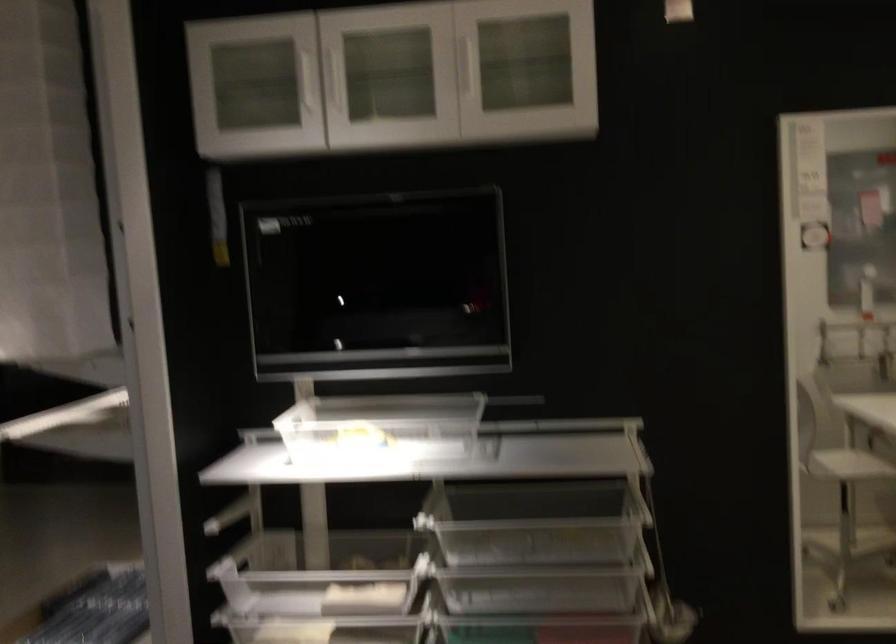
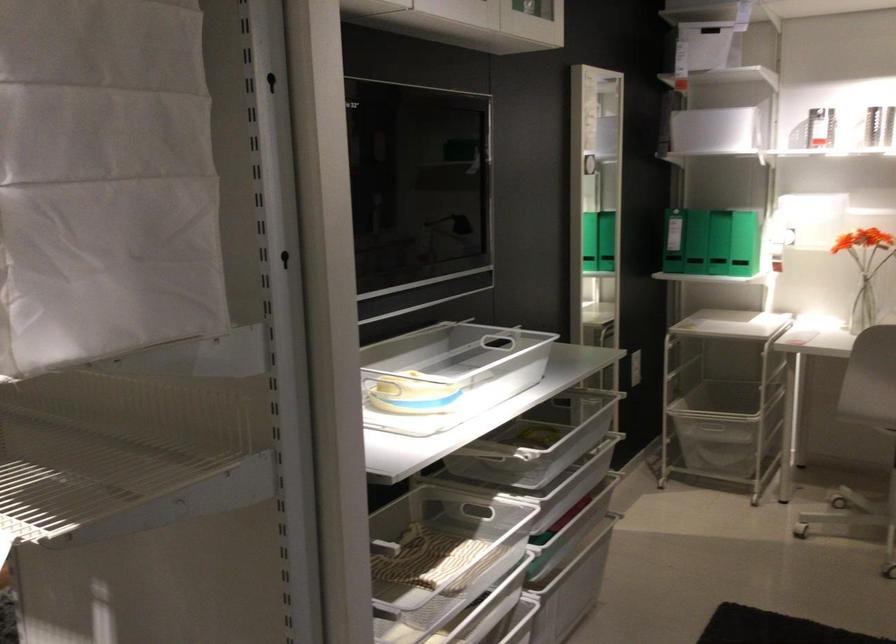
The point at [346,464] is marked in the first image. Where is the corresponding point in the second image?

(409, 392)